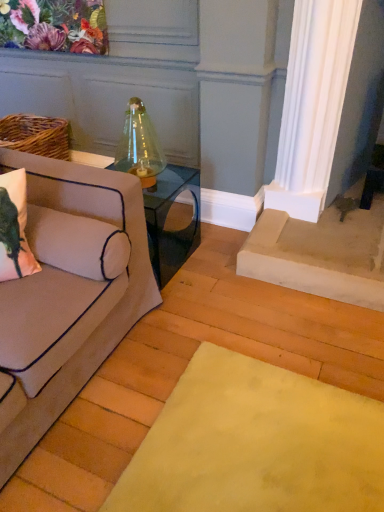
Find the location of a particular element. matte pink pillow at left is located at coordinates (14, 228).

Does clear glass table at center have a lesser height compared to matte pink pillow at left?

Incorrect, the height of clear glass table at center does not fall short of that of matte pink pillow at left.

In the image, there is a clear glass table at center. At what (x,y) coordinates should I click in order to perform the action: click on pillow below it (from the image's perspective). Please return your answer as a coordinate pair (x, y). The height and width of the screenshot is (512, 384). Looking at the image, I should click on (14, 228).

Is clear glass table at center closer to the viewer compared to matte pink pillow at left?

No.

From a real-world perspective, is clear glass table at center physically located above or below matte pink pillow at left?

Clearly, from a real-world perspective, clear glass table at center is below matte pink pillow at left.

From a real-world perspective, who is located lower, matte pink pillow at left or beige fabric couch at left?

In real-world perspective, beige fabric couch at left is lower.

Measure the distance between matte pink pillow at left and beige fabric couch at left.

matte pink pillow at left is 10.08 inches from beige fabric couch at left.

Which object is closer to the camera, matte pink pillow at left or beige fabric couch at left?

beige fabric couch at left is more forward.

At what (x,y) coordinates should I click in order to perform the action: click on pillow above the beige fabric couch at left (from the image's perspective). Please return your answer as a coordinate pair (x, y). Looking at the image, I should click on (14, 228).

From a real-world perspective, who is located higher, beige fabric couch at left or matte pink pillow at left?

matte pink pillow at left, from a real-world perspective.

Between beige fabric couch at left and matte pink pillow at left, which one has smaller size?

Smaller between the two is matte pink pillow at left.

Who is taller, beige fabric couch at left or matte pink pillow at left?

beige fabric couch at left.

Between point (87, 277) and point (25, 225), which one is positioned behind?

Point (25, 225)

I want to click on studio couch above the clear glass table at center (from a real-world perspective), so click(70, 290).

Can you tell me how much beige fabric couch at left and clear glass table at center differ in facing direction?

The angle between the facing direction of beige fabric couch at left and the facing direction of clear glass table at center is 0.804 degrees.

Is beige fabric couch at left turned away from clear glass table at center?

beige fabric couch at left is not turned away from clear glass table at center.

Is beige fabric couch at left at the left side of clear glass table at center?

Yes, beige fabric couch at left is to the left of clear glass table at center.

Can you confirm if clear glass table at center is positioned to the right of beige fabric couch at left?

Correct, you'll find clear glass table at center to the right of beige fabric couch at left.

Is point (186, 257) behind point (66, 333)?

Yes, it is.

Are clear glass table at center and beige fabric couch at left making contact?

clear glass table at center and beige fabric couch at left are clearly separated.

From the image's perspective, is matte pink pillow at left on clear glass table at center?

No.

Which object is closer to the camera, matte pink pillow at left or clear glass table at center?

matte pink pillow at left.

In terms of height, does matte pink pillow at left look taller or shorter compared to clear glass table at center?

matte pink pillow at left is shorter than clear glass table at center.

This screenshot has height=512, width=384. What are the coordinates of `table that appears on the right of matte pink pillow at left` in the screenshot? It's located at (166, 221).

There is a clear glass table at center. Identify the location of pillow above it (from a real-world perspective). This screenshot has width=384, height=512. (14, 228).

At what (x,y) coordinates should I click in order to perform the action: click on studio couch in front of the matte pink pillow at left. Please return your answer as a coordinate pair (x, y). Looking at the image, I should click on (70, 290).

Which object lies nearer to the anchor point matte pink pillow at left, clear glass table at center or beige fabric couch at left?

beige fabric couch at left lies closer to matte pink pillow at left than the other object.

Considering their positions, is beige fabric couch at left positioned closer to clear glass table at center than matte pink pillow at left?

Based on the image, beige fabric couch at left appears to be nearer to clear glass table at center.

Which object lies further to the anchor point clear glass table at center, matte pink pillow at left or beige fabric couch at left?

matte pink pillow at left lies further to clear glass table at center than the other object.

Which object lies further to the anchor point beige fabric couch at left, clear glass table at center or matte pink pillow at left?

clear glass table at center is positioned further to the anchor beige fabric couch at left.

Estimate the real-world distances between objects in this image. Which object is closer to matte pink pillow at left, beige fabric couch at left or clear glass table at center?

beige fabric couch at left is positioned closer to the anchor matte pink pillow at left.

From the image, which object appears to be farther from beige fabric couch at left, matte pink pillow at left or clear glass table at center?

clear glass table at center.

Find the location of a particular element. Image resolution: width=384 pixels, height=512 pixels. pillow positioned between beige fabric couch at left and clear glass table at center from near to far is located at coordinates (14, 228).